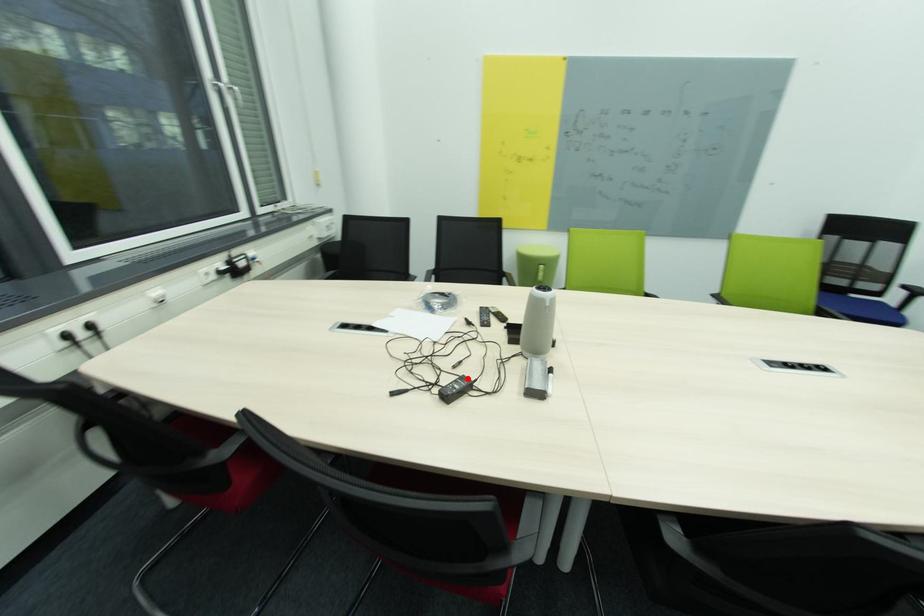
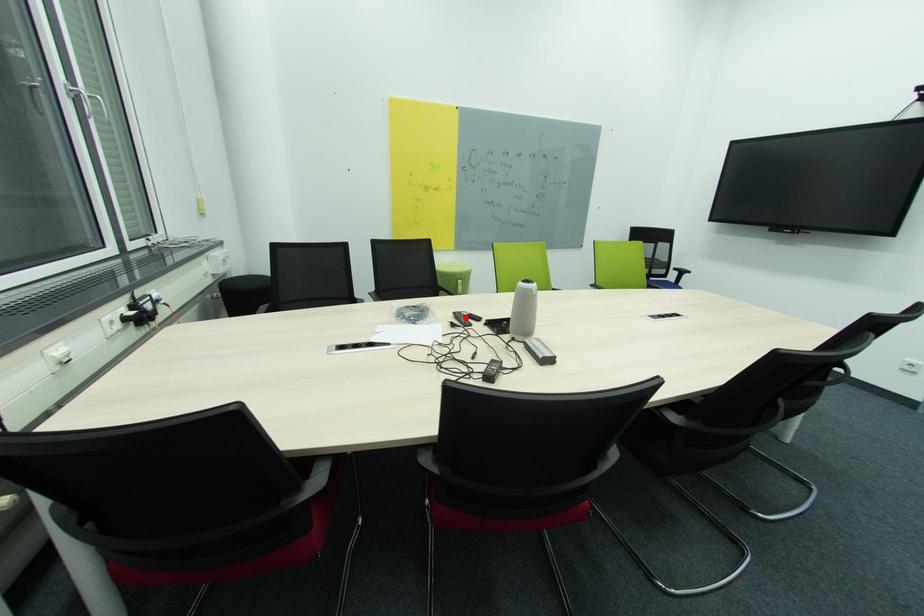
I am providing you with two images of the same scene from different viewpoints. A red point is marked on the first image and another point is marked on the second image. Do the highlighted points in image1 and image2 indicate the same real-world spot?

No